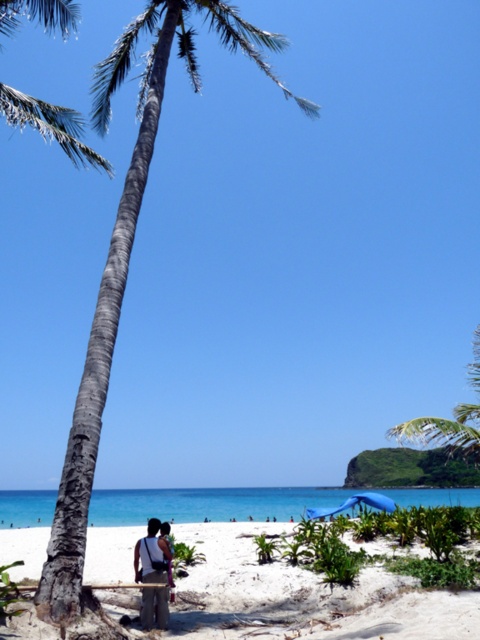
Question: Among these objects, which one is nearest to the camera?

Choices:
 (A) white sandy beach at lower center
 (B) dark gray fabric bag at lower center
 (C) gray bark palm tree at left

Answer: (A)

Question: Estimate the real-world distances between objects in this image. Which object is farther from the dark gray fabric bag at lower center?

Choices:
 (A) white sandy beach at lower center
 (B) gray bark palm tree at left

Answer: (B)

Question: Is gray bark palm tree at left thinner than dark gray fabric bag at lower center?

Choices:
 (A) no
 (B) yes

Answer: (A)

Question: Can you confirm if white sandy beach at lower center is thinner than dark gray fabric bag at lower center?

Choices:
 (A) yes
 (B) no

Answer: (B)

Question: Among these points, which one is farthest from the camera?

Choices:
 (A) (168, 618)
 (B) (260, 632)
 (C) (48, 582)

Answer: (A)

Question: Is white sandy beach at lower center thinner than gray bark palm tree at left?

Choices:
 (A) no
 (B) yes

Answer: (A)